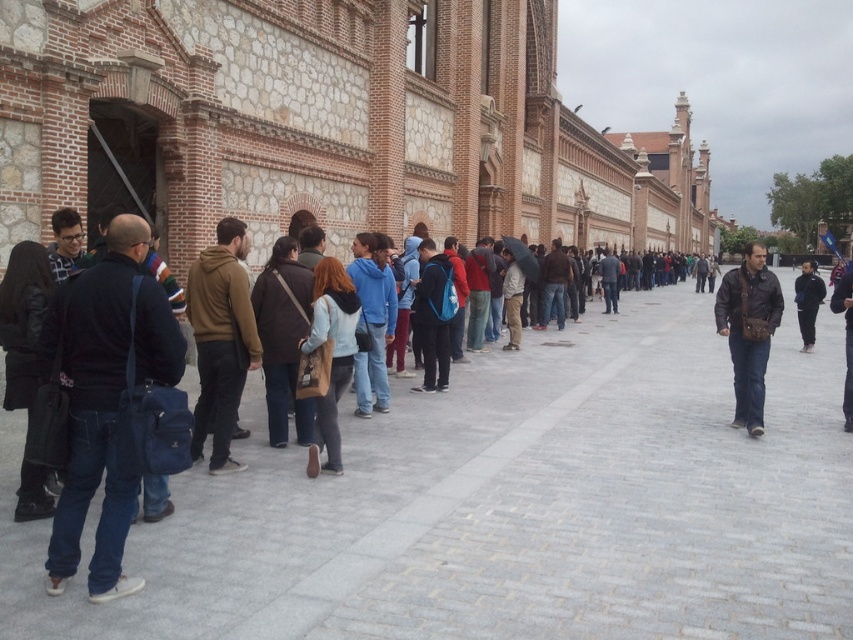
You are a photographer standing at the end of the queue and want to take a photo of the two jackets, dark blue fabric jacket at left and brown suede jacket at center. Which jacket appears wider in the photo?

The brown suede jacket at center appears wider in the photo because the dark blue fabric jacket at left has a lesser width compared to it.

You are a photographer standing at the back of the queue. You want to take a photo of both the brown suede jacket at center and the black leather jacket at center without any obstruction. Which jacket should you focus on first to ensure it appears taller in the photo?

The black leather jacket at center is taller than the brown suede jacket at center, so you should focus on the black leather jacket at center first to capture its height in the photo.